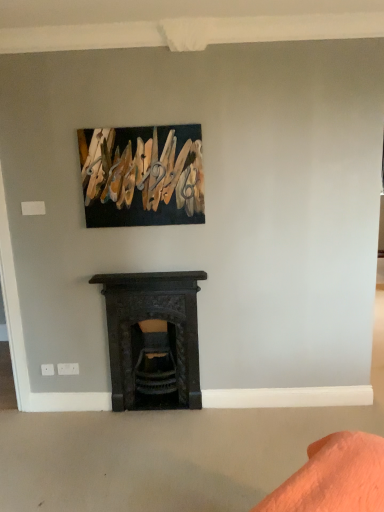
Question: Is wooden clothespins at upper center at the right side of dark gray stone fireplace at center?

Choices:
 (A) yes
 (B) no

Answer: (B)

Question: Is dark gray stone fireplace at center a part of wooden clothespins at upper center?

Choices:
 (A) no
 (B) yes

Answer: (A)

Question: Is wooden clothespins at upper center facing towards dark gray stone fireplace at center?

Choices:
 (A) yes
 (B) no

Answer: (B)

Question: Is wooden clothespins at upper center with dark gray stone fireplace at center?

Choices:
 (A) no
 (B) yes

Answer: (A)

Question: Is wooden clothespins at upper center shorter than dark gray stone fireplace at center?

Choices:
 (A) yes
 (B) no

Answer: (A)

Question: Is dark gray stone fireplace at center at the back of wooden clothespins at upper center?

Choices:
 (A) no
 (B) yes

Answer: (A)

Question: Is dark gray stone fireplace at center oriented towards wooden clothespins at upper center?

Choices:
 (A) yes
 (B) no

Answer: (B)

Question: Does dark gray stone fireplace at center have a larger size compared to wooden clothespins at upper center?

Choices:
 (A) no
 (B) yes

Answer: (B)

Question: Considering the relative positions of dark gray stone fireplace at center and wooden clothespins at upper center in the image provided, is dark gray stone fireplace at center behind wooden clothespins at upper center?

Choices:
 (A) no
 (B) yes

Answer: (B)

Question: Is dark gray stone fireplace at center positioned before wooden clothespins at upper center?

Choices:
 (A) yes
 (B) no

Answer: (B)

Question: Is dark gray stone fireplace at center located outside wooden clothespins at upper center?

Choices:
 (A) yes
 (B) no

Answer: (A)

Question: Considering the relative sizes of dark gray stone fireplace at center and wooden clothespins at upper center in the image provided, is dark gray stone fireplace at center thinner than wooden clothespins at upper center?

Choices:
 (A) yes
 (B) no

Answer: (B)

Question: Is point (168, 407) positioned closer to the camera than point (148, 204)?

Choices:
 (A) farther
 (B) closer

Answer: (A)